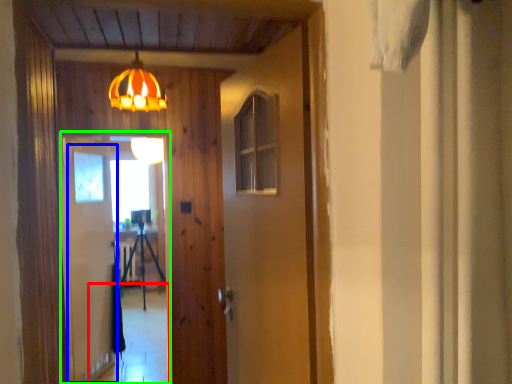
Question: Based on their relative distances, which object is nearer to corridor (highlighted by a red box)? Choose from screen door (highlighted by a blue box) and screen door (highlighted by a green box).

Choices:
 (A) screen door
 (B) screen door

Answer: (B)